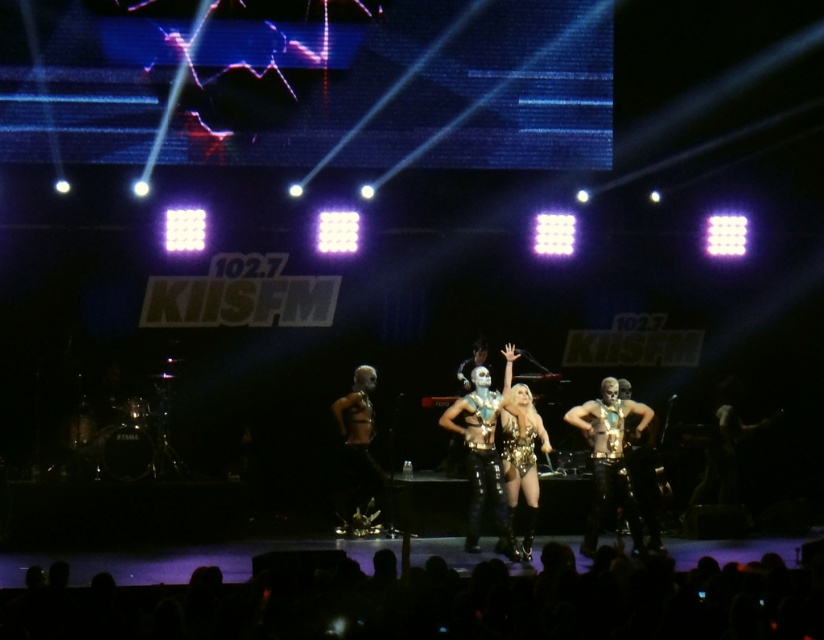
You are a photographer at the concert and want to capture a photo that includes both the point at (x=616, y=408) and the point at (x=527, y=516). Which point should you focus on to ensure both are in sharp focus?

You should focus on the point that is closer to the camera, which is point (x=527, y=516), because the depth of field will naturally include the farther point (x=616, y=408) as well.

You are a photographer at the concert and want to capture both the gold metallic suit at center and the sparkly gold bodysuit at center in a single frame. Given that your camera has a fixed focal length, which performer should you position closer to the camera to ensure both fit within the frame?

You should position the gold metallic suit at center closer to the camera since it is wider than the sparkly gold bodysuit at center, allowing both to fit within the frame when the wider performer is nearer.